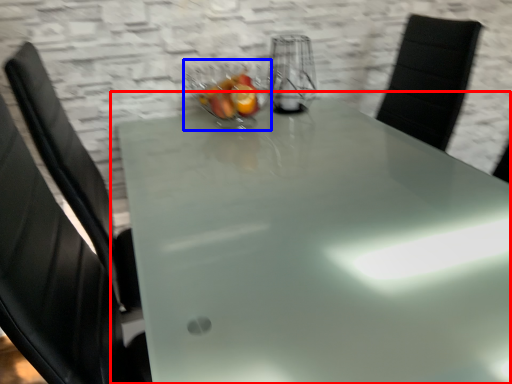
Question: Which point is closer to the camera, table (highlighted by a red box) or glass bowl (highlighted by a blue box)?

Choices:
 (A) table
 (B) glass bowl

Answer: (A)